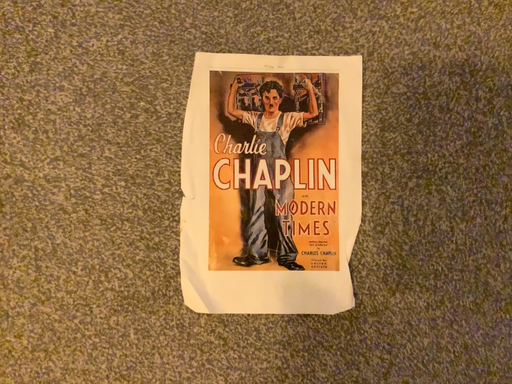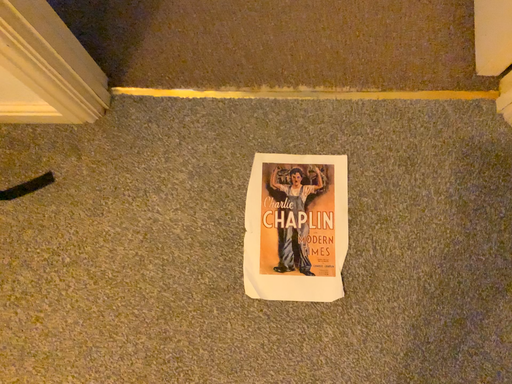
Question: Which way did the camera rotate in the video?

Choices:
 (A) rotated upward
 (B) rotated downward

Answer: (A)